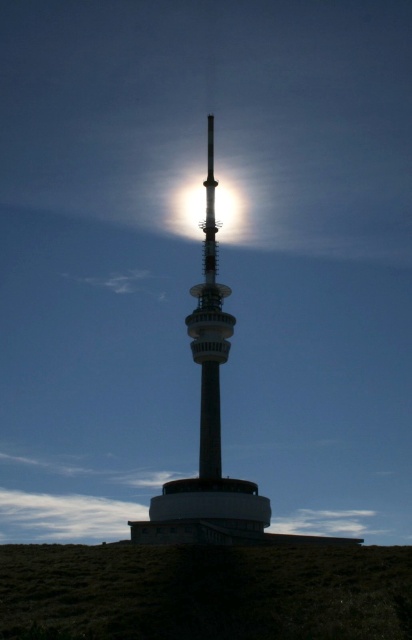
Question: Among these points, which one is nearest to the camera?

Choices:
 (A) (381, 568)
 (B) (189, 230)
 (C) (208, 307)

Answer: (A)

Question: Which point is farther from the camera taking this photo?

Choices:
 (A) (4, 602)
 (B) (168, 221)
 (C) (236, 524)

Answer: (B)

Question: Is the position of green grassy hillside at lower center more distant than that of silvery metallic tower at center?

Choices:
 (A) yes
 (B) no

Answer: (B)

Question: Does green grassy hillside at lower center lie behind bright metallic tower at center?

Choices:
 (A) yes
 (B) no

Answer: (B)

Question: Is silvery metallic tower at center smaller than bright metallic tower at center?

Choices:
 (A) yes
 (B) no

Answer: (B)

Question: Estimate the real-world distances between objects in this image. Which object is farther from the bright metallic tower at center?

Choices:
 (A) green grassy hillside at lower center
 (B) silvery metallic tower at center

Answer: (A)